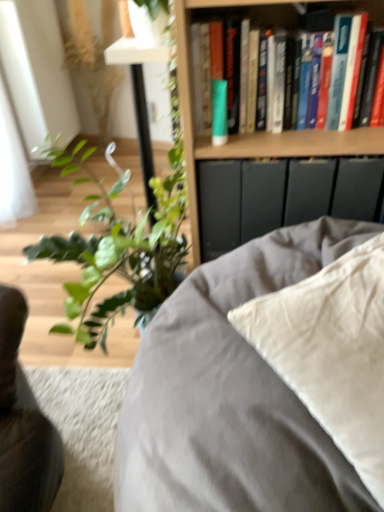
Question: Is hardcover books at upper right closer to the viewer compared to green matte tube at upper center?

Choices:
 (A) yes
 (B) no

Answer: (A)

Question: Is hardcover books at upper right next to green matte tube at upper center?

Choices:
 (A) no
 (B) yes

Answer: (A)

Question: Does hardcover books at upper right turn towards green matte tube at upper center?

Choices:
 (A) yes
 (B) no

Answer: (A)

Question: Considering the relative sizes of hardcover books at upper right and green matte tube at upper center in the image provided, is hardcover books at upper right shorter than green matte tube at upper center?

Choices:
 (A) no
 (B) yes

Answer: (A)

Question: Does hardcover books at upper right appear on the right side of green matte tube at upper center?

Choices:
 (A) no
 (B) yes

Answer: (B)

Question: Considering the relative positions of green matte tube at upper center and satin beige pillow at center in the image provided, is green matte tube at upper center to the left or to the right of satin beige pillow at center?

Choices:
 (A) left
 (B) right

Answer: (A)

Question: Is green matte tube at upper center wider or thinner than satin beige pillow at center?

Choices:
 (A) thin
 (B) wide

Answer: (A)

Question: Is green matte tube at upper center in front of or behind satin beige pillow at center in the image?

Choices:
 (A) front
 (B) behind

Answer: (B)

Question: From a real-world perspective, is green matte tube at upper center positioned above or below satin beige pillow at center?

Choices:
 (A) below
 (B) above

Answer: (B)

Question: Considering the positions of satin beige pillow at center and wooden bookshelf at upper center in the image, is satin beige pillow at center bigger or smaller than wooden bookshelf at upper center?

Choices:
 (A) small
 (B) big

Answer: (B)

Question: From their relative heights in the image, would you say satin beige pillow at center is taller or shorter than wooden bookshelf at upper center?

Choices:
 (A) short
 (B) tall

Answer: (A)

Question: In the image, is satin beige pillow at center positioned in front of or behind wooden bookshelf at upper center?

Choices:
 (A) front
 (B) behind

Answer: (A)

Question: Does point (336, 465) appear closer or farther from the camera than point (238, 140)?

Choices:
 (A) closer
 (B) farther

Answer: (A)

Question: In terms of width, does hardcover books at upper right look wider or thinner when compared to wooden bookshelf at upper center?

Choices:
 (A) wide
 (B) thin

Answer: (B)

Question: From the image's perspective, is hardcover books at upper right located above or below wooden bookshelf at upper center?

Choices:
 (A) above
 (B) below

Answer: (A)